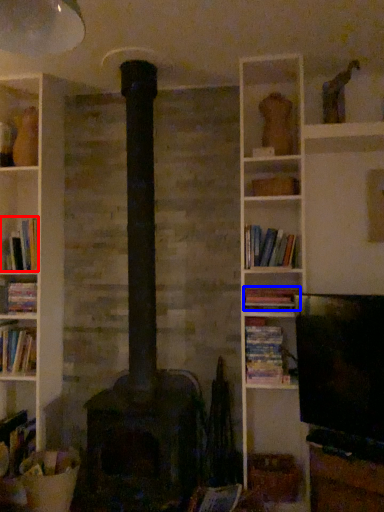
Question: Among these objects, which one is farthest to the camera, book (highlighted by a red box) or book (highlighted by a blue box)?

Choices:
 (A) book
 (B) book

Answer: (A)